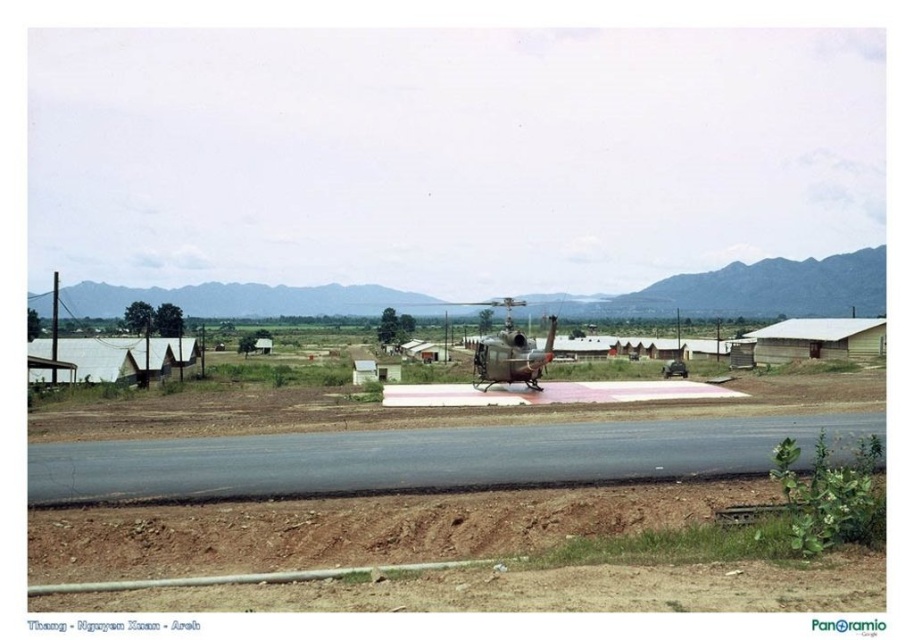
Question: Does black asphalt runway at center have a greater width compared to metallic green helicopter at center?

Choices:
 (A) yes
 (B) no

Answer: (A)

Question: Which object appears closest to the camera in this image?

Choices:
 (A) metallic green helicopter at center
 (B) black asphalt runway at center

Answer: (B)

Question: Among these objects, which one is nearest to the camera?

Choices:
 (A) black asphalt runway at center
 (B) metallic green helicopter at center

Answer: (A)

Question: Is black asphalt runway at center closer to camera compared to metallic green helicopter at center?

Choices:
 (A) no
 (B) yes

Answer: (B)

Question: Is black asphalt runway at center bigger than metallic green helicopter at center?

Choices:
 (A) no
 (B) yes

Answer: (A)